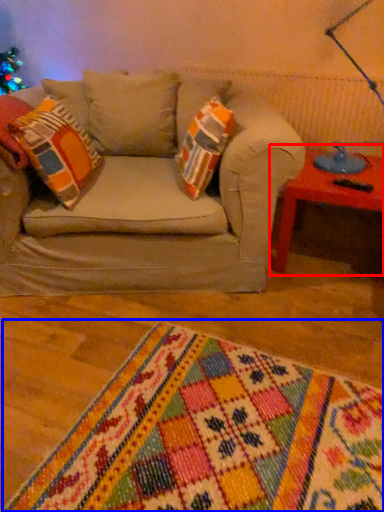
Question: Which object appears closest to the camera in this image, table (highlighted by a red box) or blanket (highlighted by a blue box)?

Choices:
 (A) table
 (B) blanket

Answer: (B)